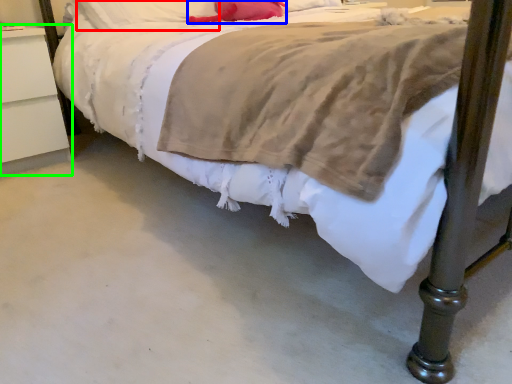
Question: Which object is the closest to the pillow (highlighted by a red box)? Choose among these: pillow (highlighted by a blue box) or nightstand (highlighted by a green box).

Choices:
 (A) pillow
 (B) nightstand

Answer: (A)